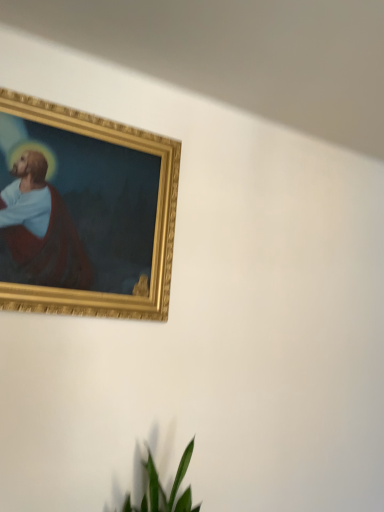
Measure the distance between gold/gilded picture frame at upper left and camera.

gold/gilded picture frame at upper left is 1.15 meters from camera.

Image resolution: width=384 pixels, height=512 pixels. Describe the element at coordinates (84, 213) in the screenshot. I see `gold/gilded picture frame at upper left` at that location.

Find the location of a particular element. gold/gilded picture frame at upper left is located at coordinates (84, 213).

The image size is (384, 512). In order to click on gold/gilded picture frame at upper left in this screenshot , I will do `click(84, 213)`.